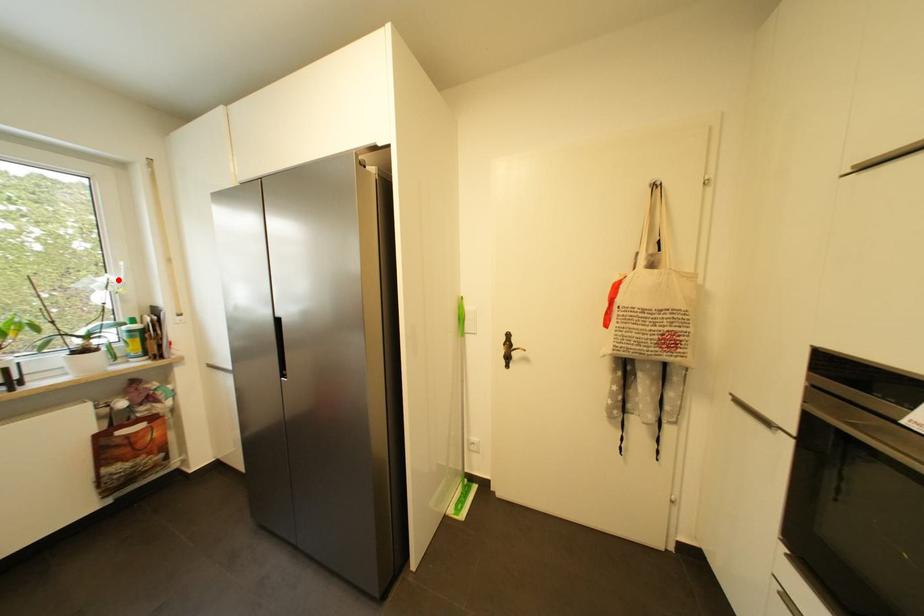
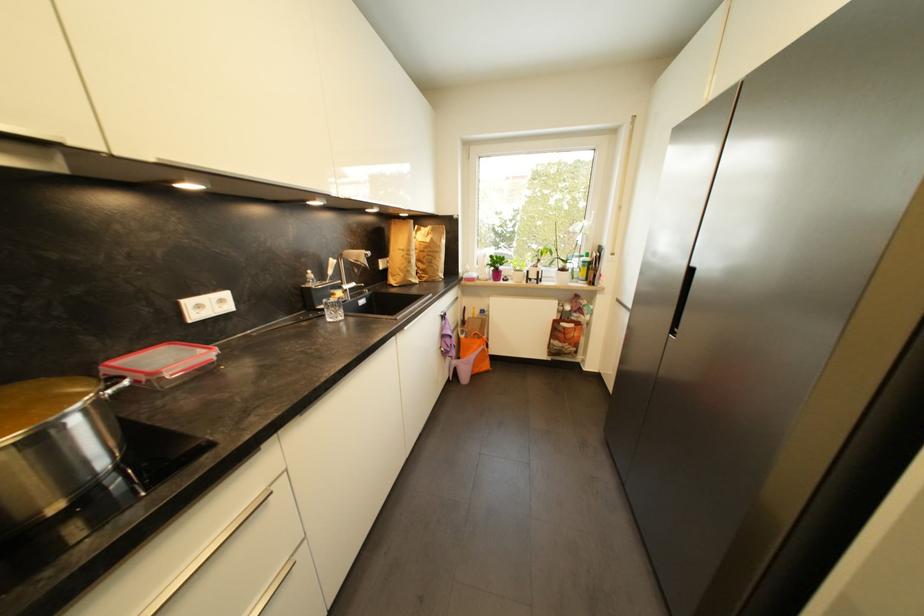
Locate, in the second image, the point that corresponds to the highlighted location in the first image.

(590, 225)